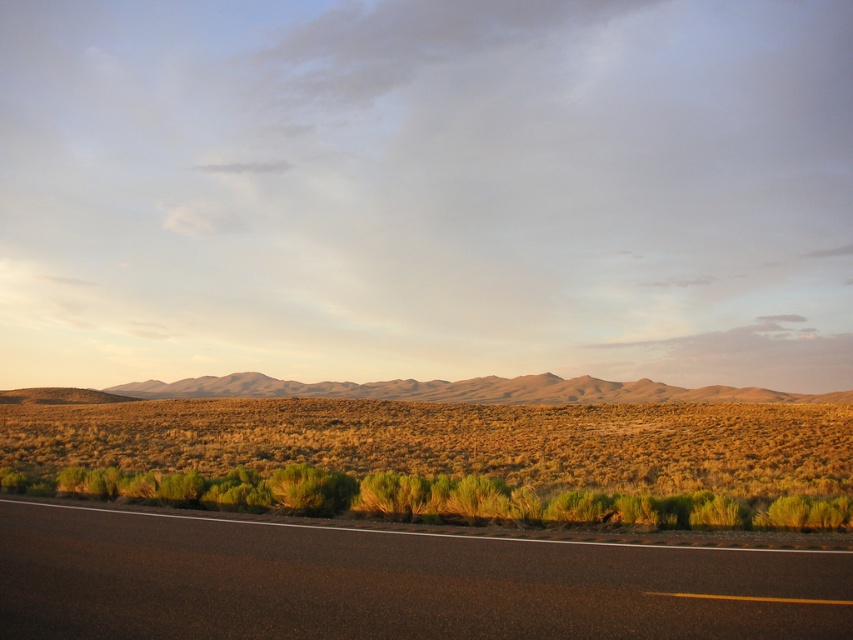
Does green shrubs at lower center appear on the left side of black asphalt road at lower left?

No, green shrubs at lower center is not to the left of black asphalt road at lower left.

Who is more distant from viewer, [347,451] or [833,588]?

The point [347,451] is behind.

Identify the location of green shrubs at lower center. (445, 458).